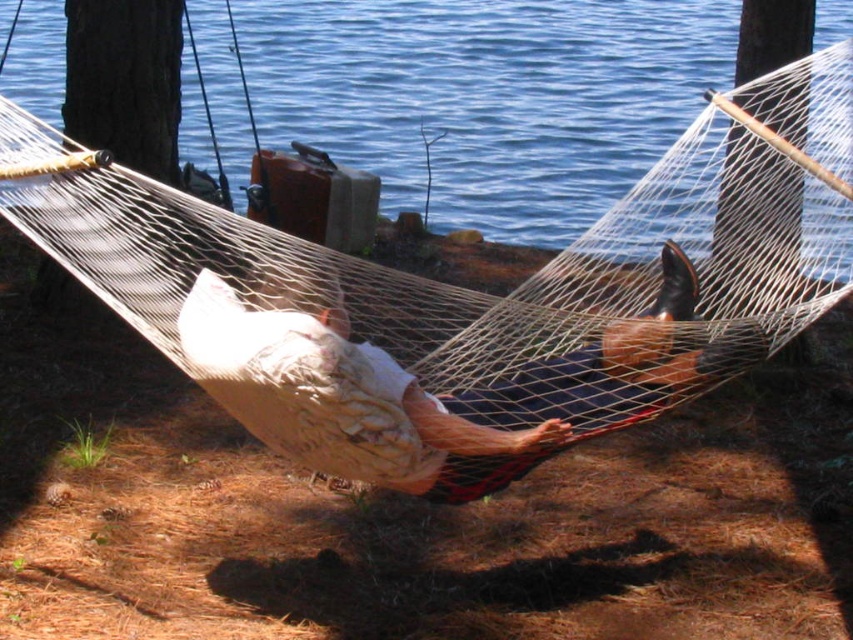
You are standing in the forest scene and want to take a photo of both the blue water at center and the white cotton shirt at center. Which object should you focus on first if you want to ensure both are in focus?

You should focus on the white cotton shirt at center first because it is closer to you than the blue water at center, which is further away. By focusing on the closer object, you can ensure both are in focus using depth of field.

You are standing in the forest scene and want to place a small decorative rock between the two points, point (461, 212) and point (598, 360). Which point should you place it closer to so that the rock appears closer to you?

You should place the rock closer to point (461, 212) because it is closer to the viewer than point (598, 360).

You are a photographer taking a picture of the blue water at center and the white cotton shirt at center. Based on their positions, which object would appear closer to the camera in the photo?

The blue water at center appears closer to the camera than the white cotton shirt at center because it is positioned above it in the image.